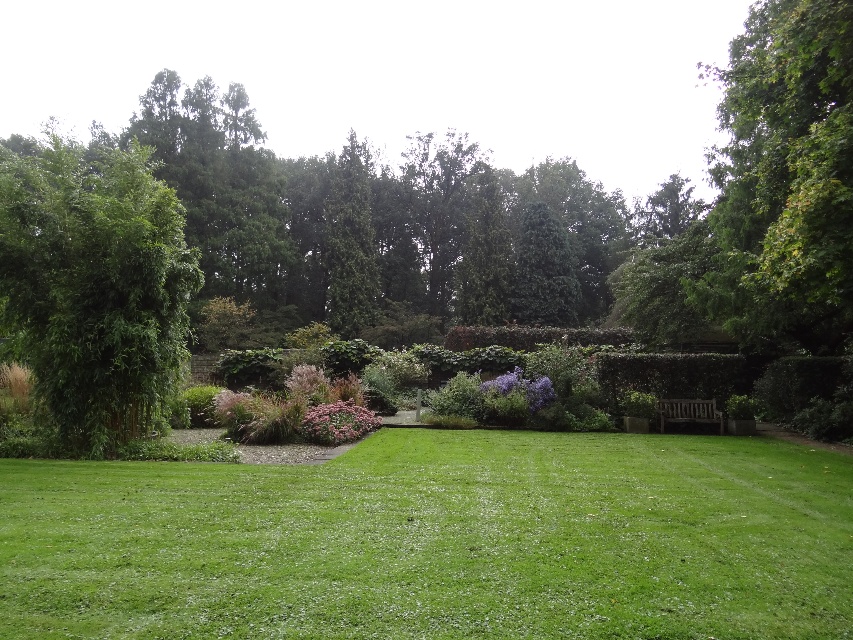
Question: Which point is farther to the camera?

Choices:
 (A) green grass at center
 (B) pink matte flower at center
 (C) purple matte flower at center
 (D) wooden bench at lower right

Answer: (C)

Question: Which of the following is the farthest from the observer?

Choices:
 (A) (158, 376)
 (B) (672, 634)
 (C) (491, 388)

Answer: (C)

Question: Which of the following is the farthest from the observer?

Choices:
 (A) wooden bench at lower right
 (B) pink matte flower at center

Answer: (A)

Question: From the image, what is the correct spatial relationship of green leafy tree at left in relation to wooden bench at lower right?

Choices:
 (A) right
 (B) left

Answer: (B)

Question: Is green leafy tree at left in front of purple matte flower at center?

Choices:
 (A) no
 (B) yes

Answer: (B)

Question: Can you confirm if green leafy tree at left is positioned to the right of pink matte flower at center?

Choices:
 (A) yes
 (B) no

Answer: (B)